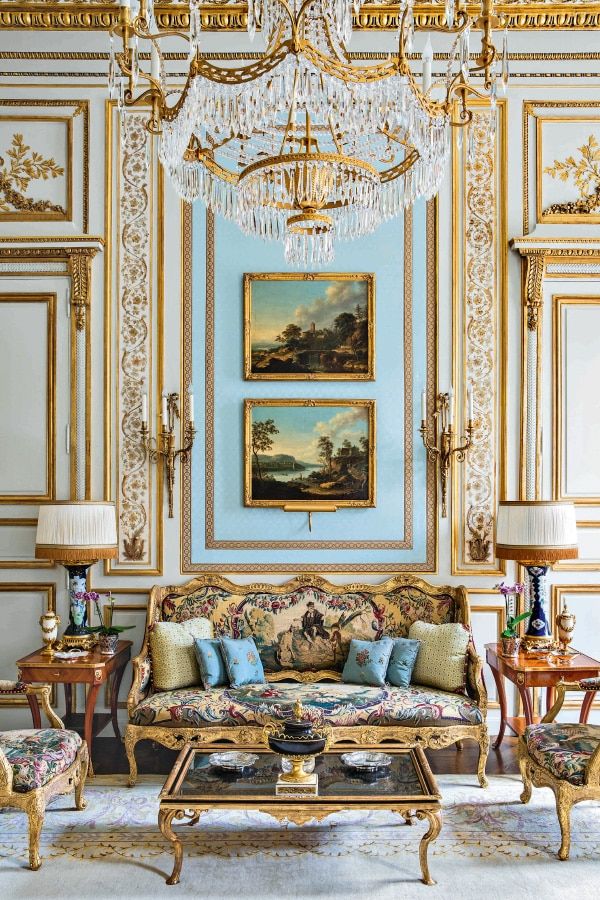
Identify the location of table. (337, 787).